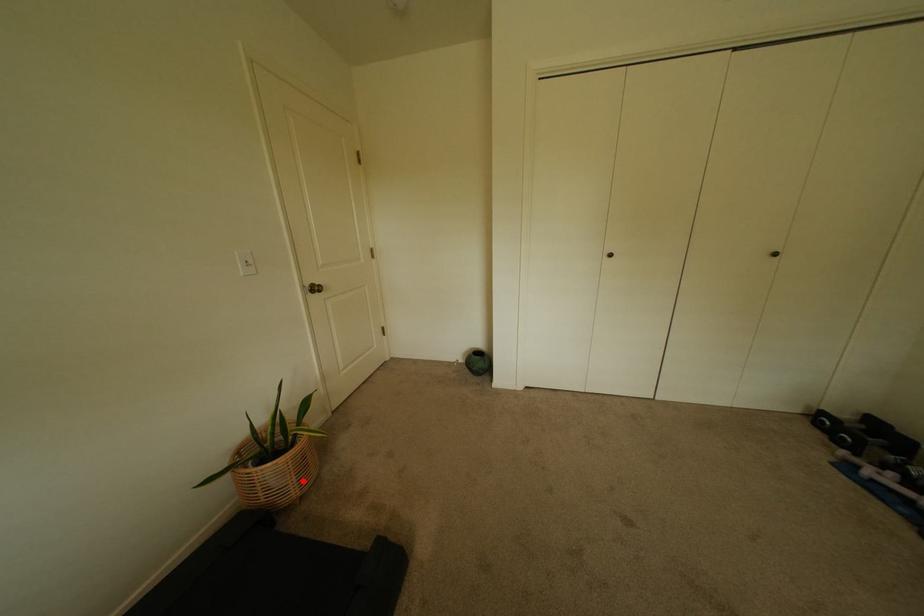
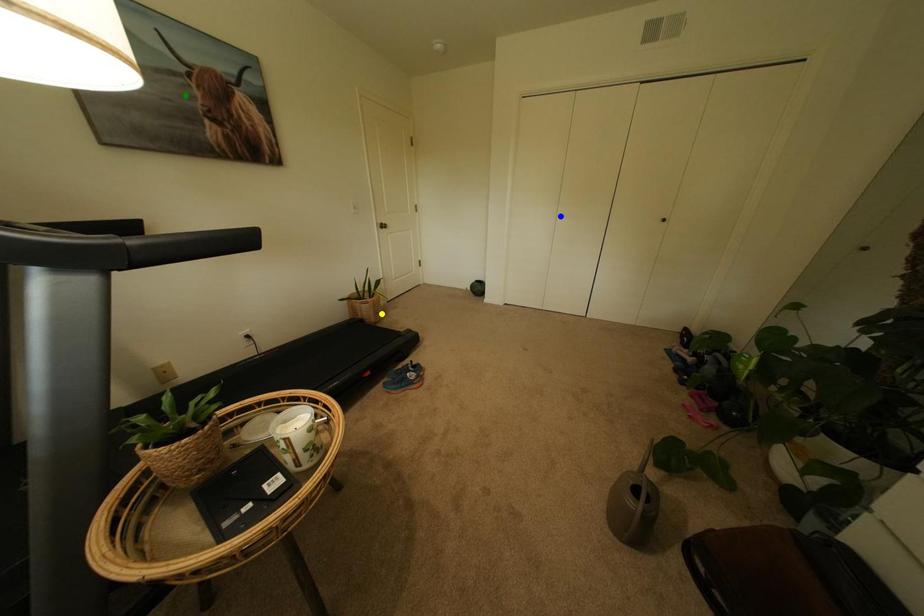
Question: I am providing you with two images of the same scene from different viewpoints. A red point is marked on the first image. You are given multiple points on the second image. Which point in image 2 is actually the same real-world point as the red point in image 1?

Choices:
 (A) yellow point
 (B) blue point
 (C) green point

Answer: (A)